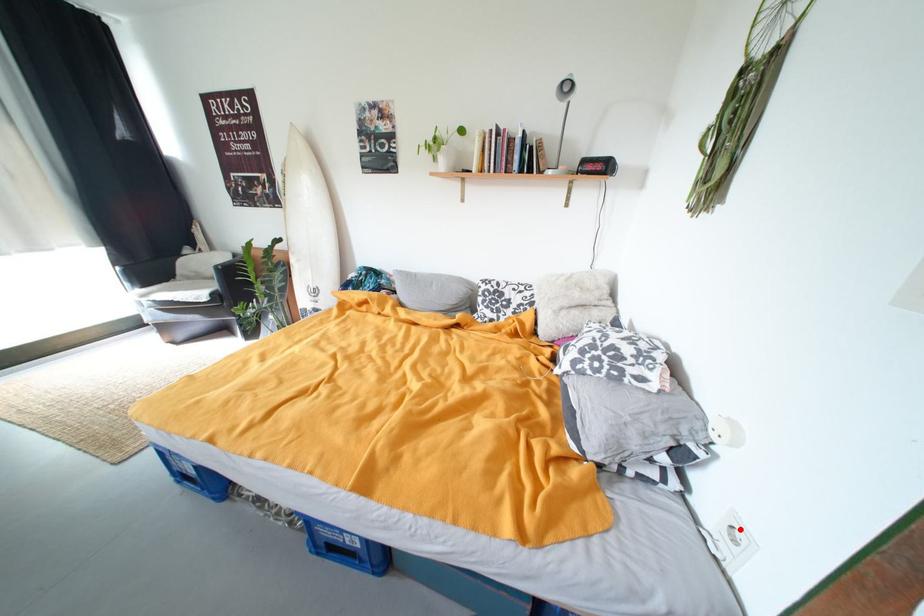
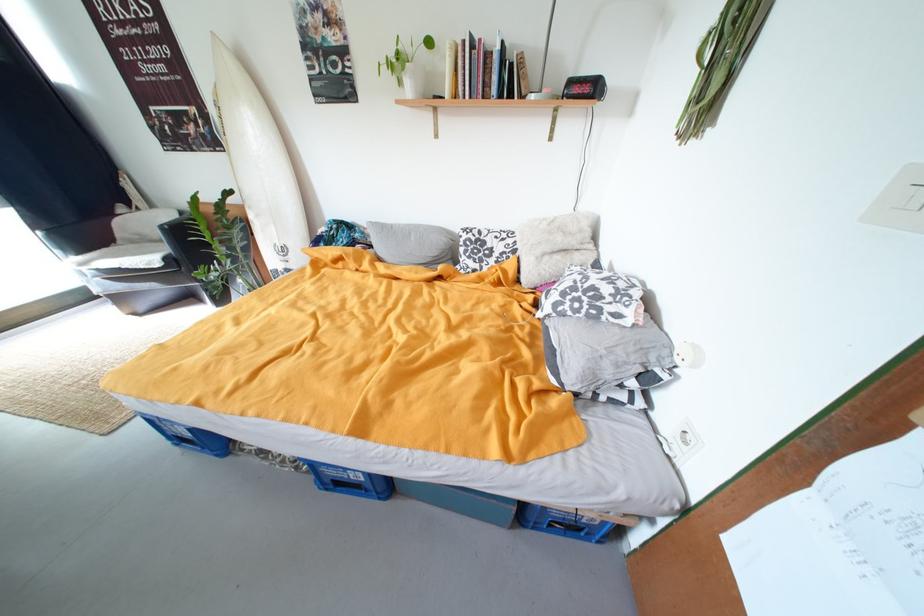
In the second image, find the point that corresponds to the highlighted location in the first image.

(693, 434)